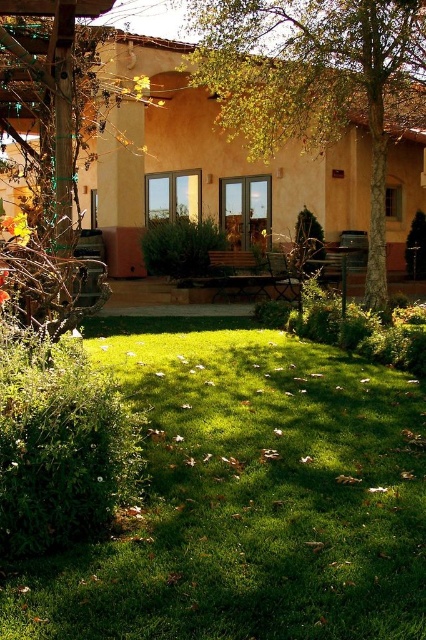
Question: Estimate the real-world distances between objects in this image. Which object is closer to the green grass at center?

Choices:
 (A) brown textured tree at left
 (B) brown textured tree at center

Answer: (A)

Question: Is brown textured tree at center in front of brown textured tree at left?

Choices:
 (A) no
 (B) yes

Answer: (A)

Question: Does green grass at center have a greater width compared to brown textured tree at center?

Choices:
 (A) no
 (B) yes

Answer: (B)

Question: Based on their relative distances, which object is farther from the green grass at center?

Choices:
 (A) brown textured tree at left
 (B) brown textured tree at center

Answer: (B)

Question: Based on their relative distances, which object is farther from the brown textured tree at left?

Choices:
 (A) brown textured tree at center
 (B) green grass at center

Answer: (A)

Question: Is brown textured tree at center below brown textured tree at left?

Choices:
 (A) yes
 (B) no

Answer: (B)